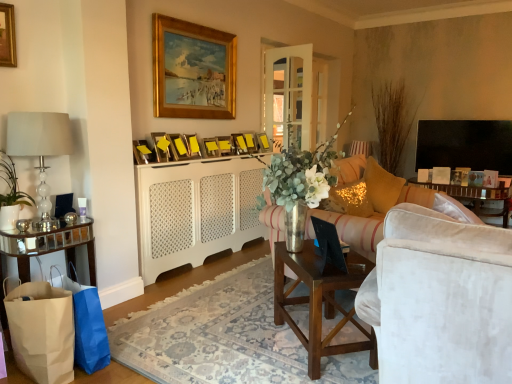
At what (x,y) coordinates should I click in order to perform the action: click on vacant space to the left of wooden table at center, which appears as the 2th table when viewed from the left. Please return your answer as a coordinate pair (x, y). Image resolution: width=512 pixels, height=384 pixels. Looking at the image, I should click on (249, 349).